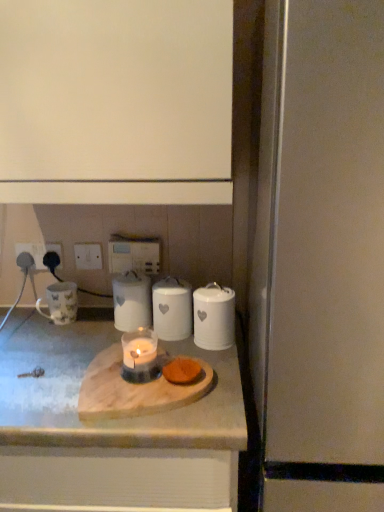
You are a GUI agent. You are given a task and a screenshot of the screen. Output one action in this format:
    pyautogui.click(x=<x>, y=<y>)
    Task: Click on the vacant area that is in front of white ceramic jar at center, the 3th appliance in the right-to-left sequence
    The width and height of the screenshot is (384, 512).
    Given the screenshot: What is the action you would take?
    pyautogui.click(x=198, y=357)